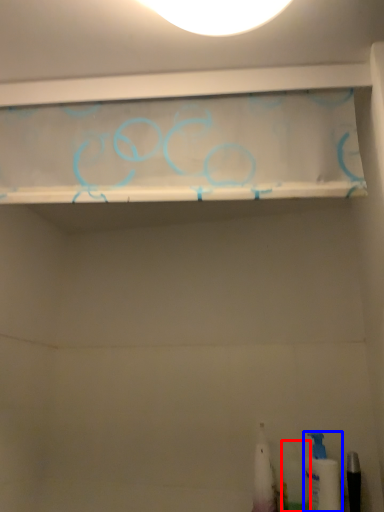
Question: Which object is further to the camera taking this photo, toiletry (highlighted by a red box) or toiletry (highlighted by a blue box)?

Choices:
 (A) toiletry
 (B) toiletry

Answer: (A)